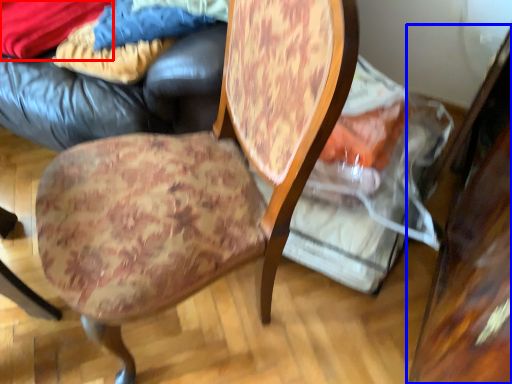
Question: Which object appears farthest to the camera in this image, fabric (highlighted by a red box) or table (highlighted by a blue box)?

Choices:
 (A) fabric
 (B) table

Answer: (A)